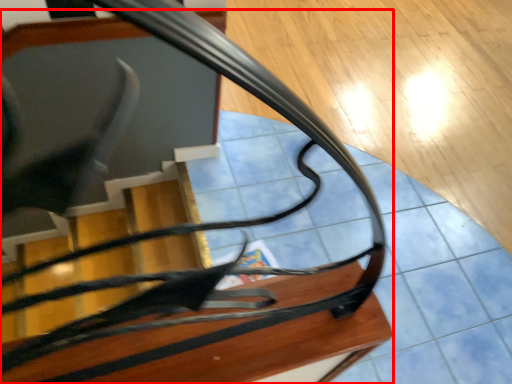
Question: From the image's perspective, what is the correct spatial positioning of furniture (annotated by the red box) in reference to table?

Choices:
 (A) below
 (B) above

Answer: (B)